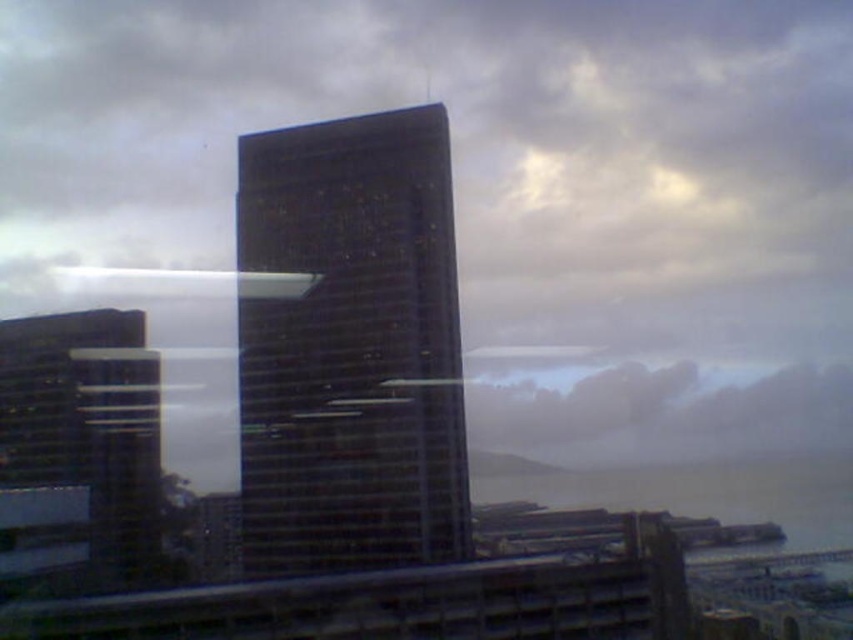
You are standing in the city square and see both the dark glass skyscraper at center and the glassy reflective skyscraper at left. Which one is located more to the right from your perspective?

The dark glass skyscraper at center is positioned on the right side of the glassy reflective skyscraper at left, so it is more to the right from your perspective.

You are an architect analyzing the cityscape. You see the dark glass skyscraper at center and the gray water at lower right. Which object appears smaller in the image?

The dark glass skyscraper at center appears smaller compared to the gray water at lower right.